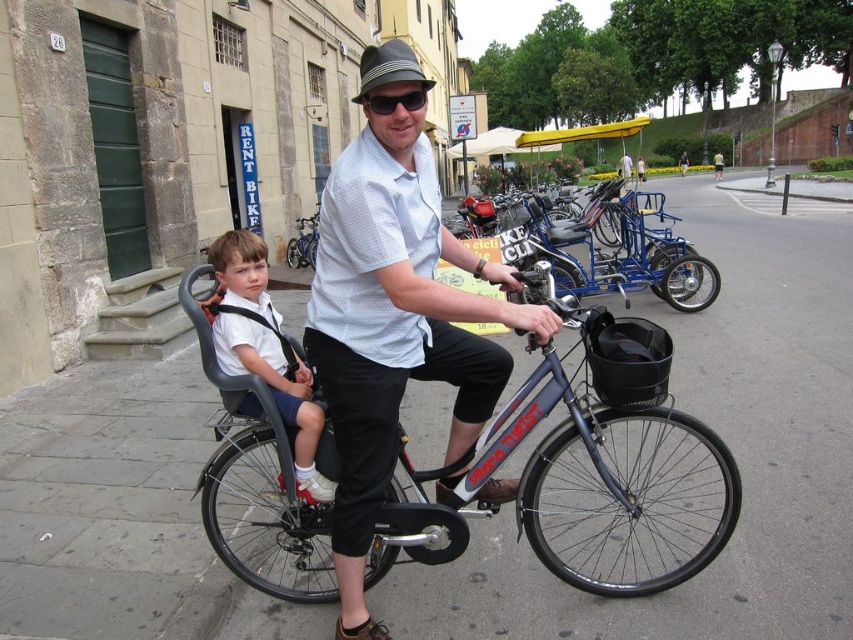
From the picture: You are a tourist standing on the sidewalk and see the white fabric shirt at left and the metallic silver bicycle at center. Which object is nearer to you?

The white fabric shirt at left is closer to the viewer than the metallic silver bicycle at center.

You are standing at point (222,348) and want to walk to point (693,566). Which direction should you go?

You should walk towards the direction of the man and young boy riding the bicycle because point (693,566) is behind point (222,348).